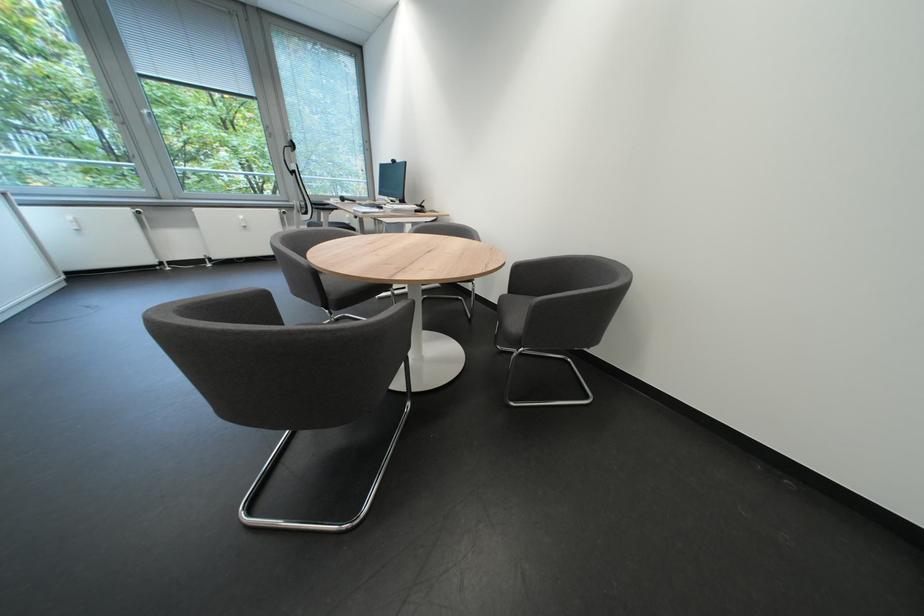
I want to click on window handle, so click(251, 156).